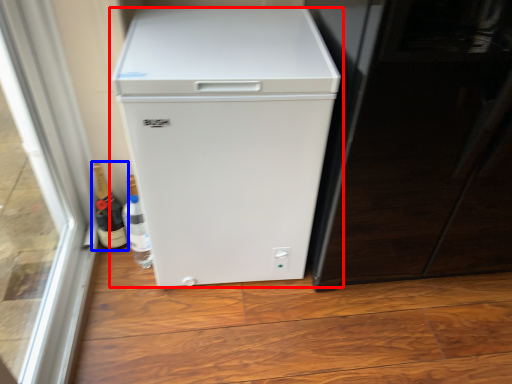
Question: Which point is closer to the camera, refrigerator (highlighted by a red box) or bottle (highlighted by a blue box)?

Choices:
 (A) refrigerator
 (B) bottle

Answer: (A)